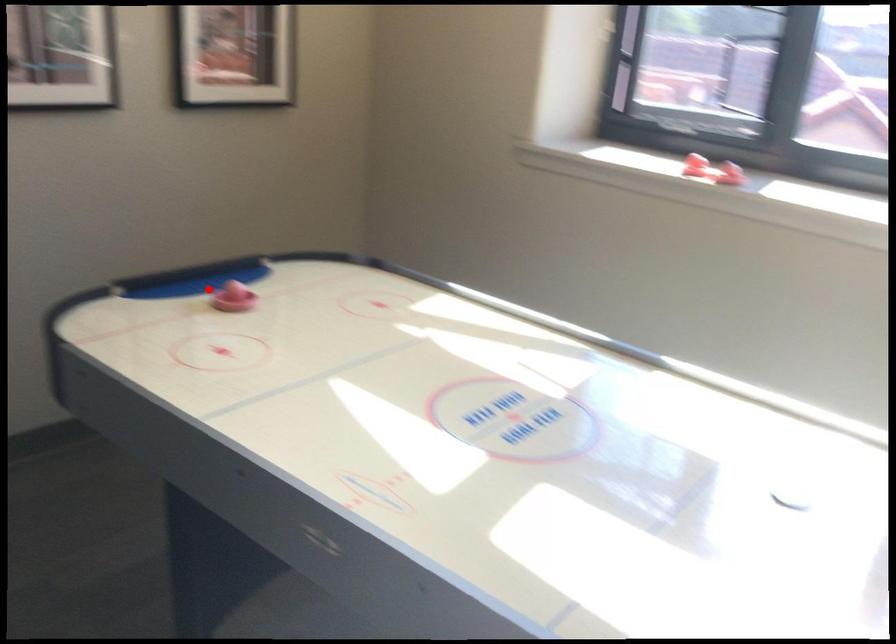
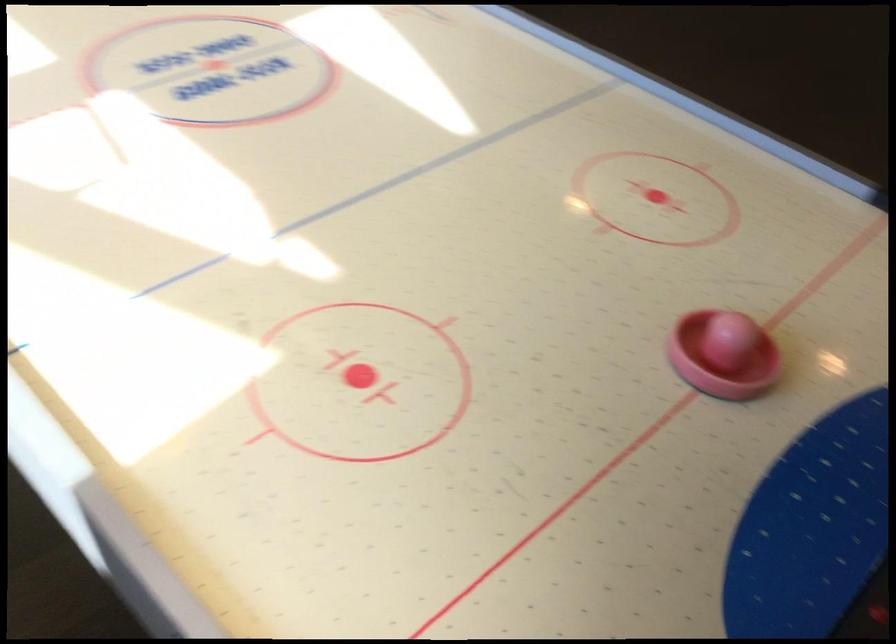
Question: I am providing you with two images of the same scene from different viewpoints. Given a red point in image1, look at the same physical point in image2. Is it:

Choices:
 (A) Closer to the viewpoint
 (B) Farther from the viewpoint

Answer: (A)